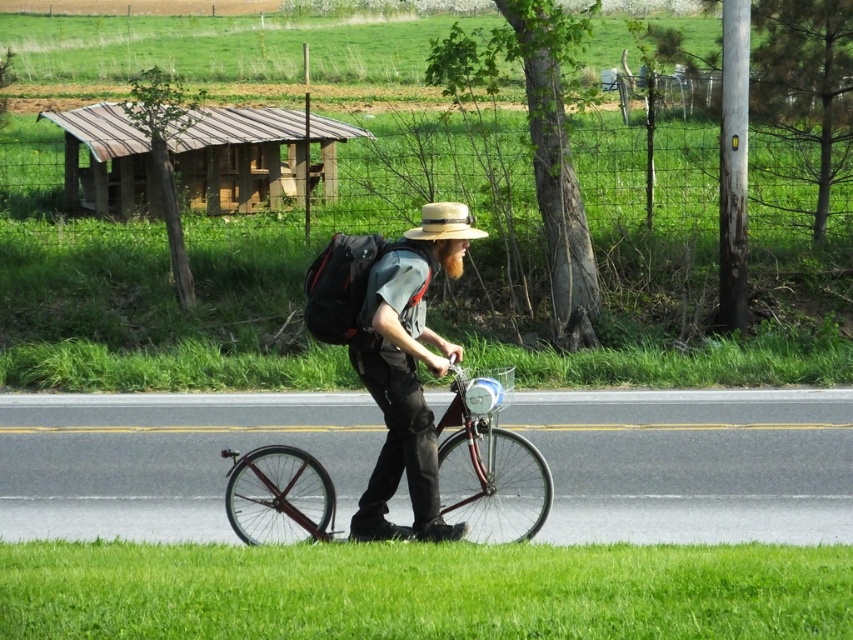
Is matte brown hat at center positioned in front of shiny red bicycle at center?

Yes.

Which of these two, matte brown hat at center or shiny red bicycle at center, stands taller?

Standing taller between the two is matte brown hat at center.

Between point (372, 340) and point (233, 484), which one is positioned behind?

The point (233, 484) is behind.

Locate an element on the screen. This screenshot has height=640, width=853. matte brown hat at center is located at coordinates (407, 371).

Between matte brown hat at center and woven straw hat at center, which one appears on the left side from the viewer's perspective?

From the viewer's perspective, matte brown hat at center appears more on the left side.

Can you confirm if matte brown hat at center is taller than woven straw hat at center?

Yes, matte brown hat at center is taller than woven straw hat at center.

The image size is (853, 640). What do you see at coordinates (407, 371) in the screenshot?
I see `matte brown hat at center` at bounding box center [407, 371].

At what (x,y) coordinates should I click in order to perform the action: click on matte brown hat at center. Please return your answer as a coordinate pair (x, y). This screenshot has width=853, height=640. Looking at the image, I should click on (407, 371).

Consider the image. Does rusty wood hut at upper left come behind shiny red bicycle at center?

Yes, it is behind shiny red bicycle at center.

I want to click on rusty wood hut at upper left, so click(x=254, y=157).